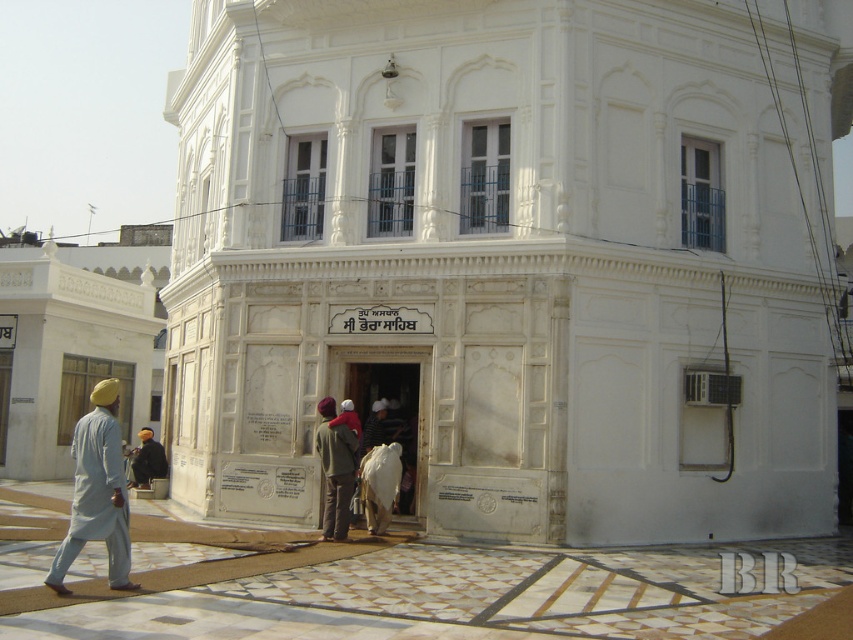
From the picture: Is light gray cotton kurta at left taller than dark blue fabric at lower left?

Correct, light gray cotton kurta at left is much taller as dark blue fabric at lower left.

Which is above, light gray cotton kurta at left or dark blue fabric at lower left?

light gray cotton kurta at left is above.

Does point (115, 435) lie in front of point (141, 432)?

Yes, it is in front of point (141, 432).

Where is `light gray cotton kurta at left`? Image resolution: width=853 pixels, height=640 pixels. light gray cotton kurta at left is located at coordinates (97, 492).

Is light brown fabric jacket at center wider than dark blue fabric at lower left?

Indeed, light brown fabric jacket at center has a greater width compared to dark blue fabric at lower left.

Is point (347, 468) less distant than point (163, 468)?

Yes, it is in front of point (163, 468).

Who is more forward, (334, 504) or (149, 449)?

Point (334, 504) is in front.

Where is `light brown fabric jacket at center`? Image resolution: width=853 pixels, height=640 pixels. light brown fabric jacket at center is located at coordinates (335, 468).

Looking at this image, who is taller, light gray cotton kurta at left or light brown fabric jacket at center?

Standing taller between the two is light gray cotton kurta at left.

Which is more to the left, light gray cotton kurta at left or light brown fabric jacket at center?

From the viewer's perspective, light gray cotton kurta at left appears more on the left side.

The height and width of the screenshot is (640, 853). What do you see at coordinates (97, 492) in the screenshot? I see `light gray cotton kurta at left` at bounding box center [97, 492].

The height and width of the screenshot is (640, 853). In order to click on light gray cotton kurta at left in this screenshot , I will do `click(97, 492)`.